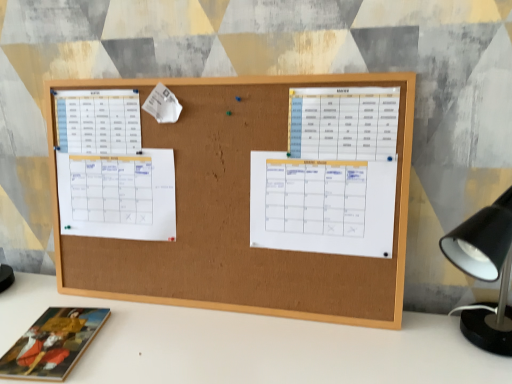
Question: Considering their positions, is wooden book at lower left located in front of or behind white paper at left, which ranks as the first list in left-to-right order?

Choices:
 (A) front
 (B) behind

Answer: (A)

Question: Is point (52, 314) closer or farther from the camera than point (96, 104)?

Choices:
 (A) farther
 (B) closer

Answer: (B)

Question: Estimate the real-world distances between objects in this image. Which object is farther from the corkboard at center?

Choices:
 (A) white paper calendar at center, positioned as the third list in left-to-right order
 (B) white paper at left, which is counted as the fourth list, starting from the right
 (C) white paper calendar at center, arranged as the 1th list when viewed from the right
 (D) white paper calendar at left, the third list when ordered from right to left
 (E) wooden book at lower left

Answer: (E)

Question: Based on their relative distances, which object is nearer to the white paper at left, which is counted as the fourth list, starting from the right?

Choices:
 (A) white paper calendar at center, arranged as the 1th list when viewed from the right
 (B) corkboard at center
 (C) wooden book at lower left
 (D) white paper calendar at left, the third list when ordered from right to left
 (E) white paper calendar at center, marked as the second list in a right-to-left arrangement

Answer: (D)